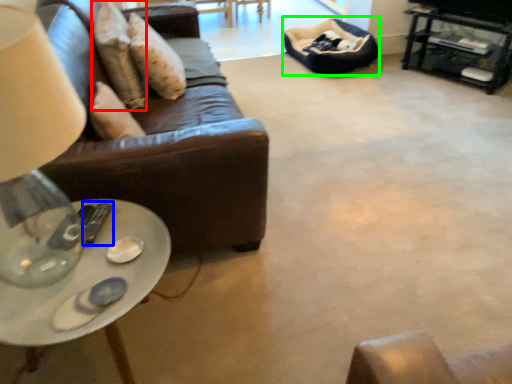
Question: Based on their relative distances, which object is nearer to pillow (highlighted by a red box)? Choose from remote (highlighted by a blue box) and bean bag chair (highlighted by a green box).

Choices:
 (A) remote
 (B) bean bag chair

Answer: (A)